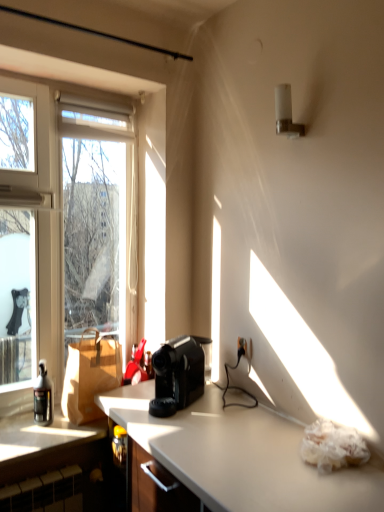
This screenshot has height=512, width=384. Find the location of `black plastic coffee maker at center`. black plastic coffee maker at center is located at coordinates (178, 375).

Measure the distance between point (37, 403) and camera.

Point (37, 403) is 2.01 meters away from camera.

This screenshot has height=512, width=384. What do you see at coordinates (52, 465) in the screenshot?
I see `metallic silver cabinet at left` at bounding box center [52, 465].

This screenshot has width=384, height=512. What are the coordinates of `black plastic coffee maker at center` in the screenshot? It's located at (178, 375).

How many degrees apart are the facing directions of brown paper bag at left and translucent glass bottle at left?

The facing directions of brown paper bag at left and translucent glass bottle at left are 6.76 degrees apart.

Would you say brown paper bag at left contains translucent glass bottle at left?

No, translucent glass bottle at left is not surrounded by brown paper bag at left.

Does brown paper bag at left lie in front of translucent glass bottle at left?

That is False.

Which object is positioned more to the left, brown paper bag at left or translucent glass bottle at left?

translucent glass bottle at left is more to the left.

Is the position of brown paper bag at left more distant than that of white frosted glass at upper right?

Yes, the depth of brown paper bag at left is greater than that of white frosted glass at upper right.

Would you say brown paper bag at left is to the left or to the right of white frosted glass at upper right in the picture?

From the image, it's evident that brown paper bag at left is to the left of white frosted glass at upper right.

Is brown paper bag at left next to white frosted glass at upper right?

brown paper bag at left and white frosted glass at upper right are clearly separated.

The image size is (384, 512). Find the location of `lamp that appears above the brown paper bag at left (from a real-world perspective)`. lamp that appears above the brown paper bag at left (from a real-world perspective) is located at coordinates (285, 112).

From the image's perspective, between white frosted glass at upper right and transparent glass window at left, who is located below?

transparent glass window at left, from the image's perspective.

Is white frosted glass at upper right not inside transparent glass window at left?

Yes, white frosted glass at upper right is not within transparent glass window at left.

How different are the orientations of white frosted glass at upper right and transparent glass window at left in degrees?

The facing directions of white frosted glass at upper right and transparent glass window at left are 91.2 degrees apart.

In the scene shown: Are white frosted glass at upper right and transparent glass window at left located far from each other?

Yes, white frosted glass at upper right and transparent glass window at left are quite far apart.

Is translucent glass bottle at left far from white frosted glass at upper right?

That's right, there is a large distance between translucent glass bottle at left and white frosted glass at upper right.

Which is behind, point (49, 410) or point (283, 122)?

Point (49, 410)

From the image's perspective, is translucent glass bottle at left beneath white frosted glass at upper right?

Yes, from the image's perspective, translucent glass bottle at left is beneath white frosted glass at upper right.

Can you tell me how much translucent glass bottle at left and white frosted glass at upper right differ in facing direction?

The angular difference between translucent glass bottle at left and white frosted glass at upper right is 90.7 degrees.

Is translucent glass bottle at left spatially inside black plastic coffee maker at center, or outside of it?

translucent glass bottle at left is not enclosed by black plastic coffee maker at center.

Based on the photo, is the depth of translucent glass bottle at left greater than that of black plastic coffee maker at center?

Yes, translucent glass bottle at left is further from the camera.

Considering the positions of objects translucent glass bottle at left and black plastic coffee maker at center in the image provided, who is more to the right, translucent glass bottle at left or black plastic coffee maker at center?

black plastic coffee maker at center is more to the right.

Is black plastic coffee maker at center at the back of translucent glass bottle at left?

No, black plastic coffee maker at center is not at the back of translucent glass bottle at left.

Considering the relative sizes of black plastic coffee maker at center and transparent glass window at left in the image provided, is black plastic coffee maker at center taller than transparent glass window at left?

In fact, black plastic coffee maker at center may be shorter than transparent glass window at left.

Is black plastic coffee maker at center far from transparent glass window at left?

No.

Is black plastic coffee maker at center to the left of transparent glass window at left from the viewer's perspective?

In fact, black plastic coffee maker at center is to the right of transparent glass window at left.

From the image's perspective, which one is positioned lower, metallic silver cabinet at left or black plastic coffee maker at center?

metallic silver cabinet at left, from the image's perspective.

Who is shorter, metallic silver cabinet at left or black plastic coffee maker at center?

Standing shorter between the two is metallic silver cabinet at left.

Is black plastic coffee maker at center located within metallic silver cabinet at left?

No, black plastic coffee maker at center is not surrounded by metallic silver cabinet at left.

Is black plastic coffee maker at center at the back of metallic silver cabinet at left?

No, metallic silver cabinet at left is not facing the opposite direction of black plastic coffee maker at center.

The image size is (384, 512). Find the location of `bottle located underneath the brown paper bag at left (from a real-world perspective)`. bottle located underneath the brown paper bag at left (from a real-world perspective) is located at coordinates (43, 397).

The image size is (384, 512). In order to click on cardboard box that is below the white frosted glass at upper right (from the image's perspective) in this screenshot , I will do `click(90, 376)`.

When comparing their distances from brown paper bag at left, does translucent glass bottle at left or white frosted glass at upper right seem closer?

translucent glass bottle at left lies closer to brown paper bag at left than the other object.

Based on their spatial positions, is black plastic coffee maker at center or white frosted glass at upper right further from translucent glass bottle at left?

white frosted glass at upper right.

Estimate the real-world distances between objects in this image. Which object is further from white frosted glass at upper right, black plastic coffee maker at center or transparent glass window at left?

transparent glass window at left is positioned further to the anchor white frosted glass at upper right.

Looking at the image, which one is located closer to translucent glass bottle at left, metallic silver cabinet at left or white frosted glass at upper right?

Based on the image, metallic silver cabinet at left appears to be nearer to translucent glass bottle at left.

Estimate the real-world distances between objects in this image. Which object is closer to brown paper bag at left, transparent glass window at left or black plastic coffee maker at center?

transparent glass window at left is positioned closer to the anchor brown paper bag at left.

In the scene shown: Based on their spatial positions, is black plastic coffee maker at center or metallic silver cabinet at left closer to transparent glass window at left?

metallic silver cabinet at left is positioned closer to the anchor transparent glass window at left.

Considering their positions, is brown paper bag at left positioned closer to transparent glass window at left than black plastic coffee maker at center?

Among the two, brown paper bag at left is located nearer to transparent glass window at left.

Which object lies nearer to the anchor point brown paper bag at left, translucent glass bottle at left or metallic silver cabinet at left?

translucent glass bottle at left lies closer to brown paper bag at left than the other object.

Where is `coffee maker between transparent glass window at left and metallic silver cabinet at left from top to bottom`? coffee maker between transparent glass window at left and metallic silver cabinet at left from top to bottom is located at coordinates (178, 375).

I want to click on window situated between translucent glass bottle at left and black plastic coffee maker at center from left to right, so click(66, 241).

The height and width of the screenshot is (512, 384). I want to click on window that lies between white frosted glass at upper right and metallic silver cabinet at left from top to bottom, so click(66, 241).

Identify the location of bottle between white frosted glass at upper right and metallic silver cabinet at left in the up-down direction. (43, 397).